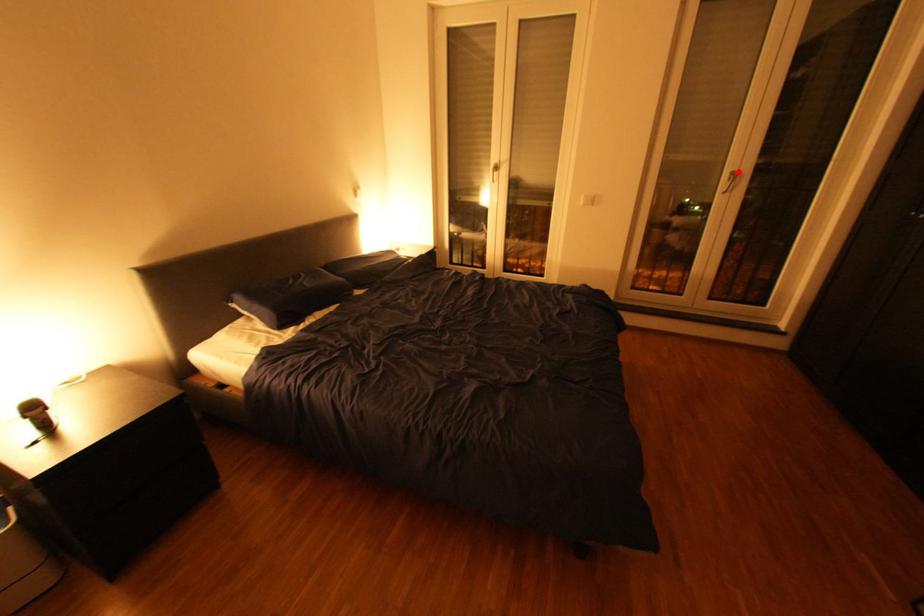
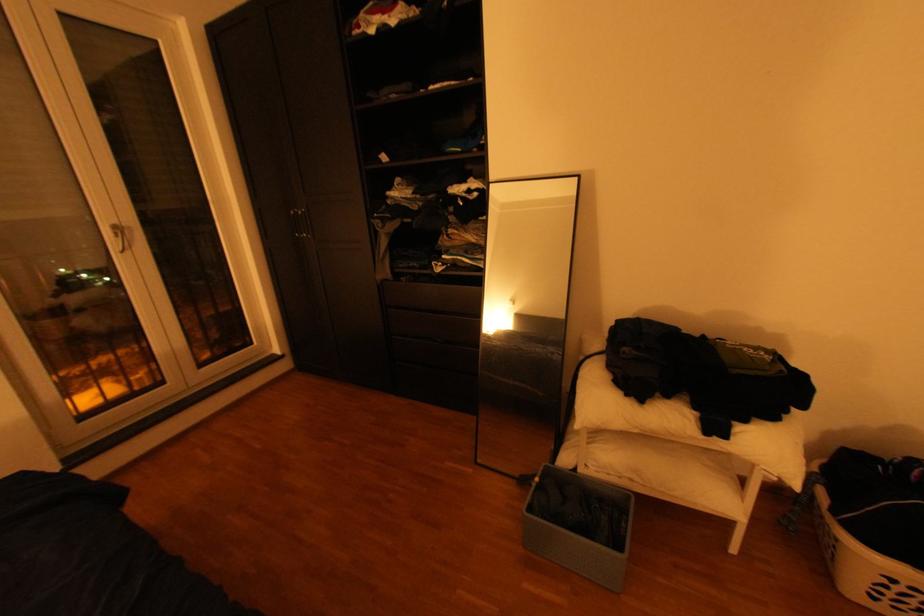
The point at the highlighted location is marked in the first image. Where is the corresponding point in the second image?

(117, 225)